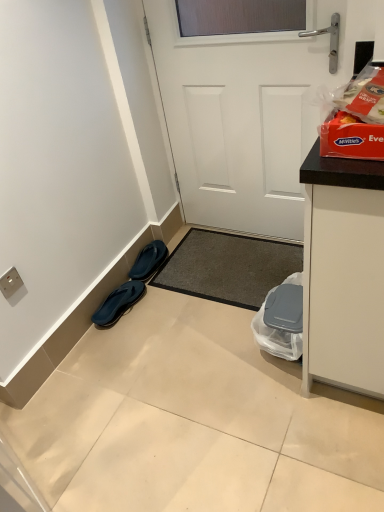
Find the location of `free location in front of dark gray carpet at center`. free location in front of dark gray carpet at center is located at coordinates (210, 361).